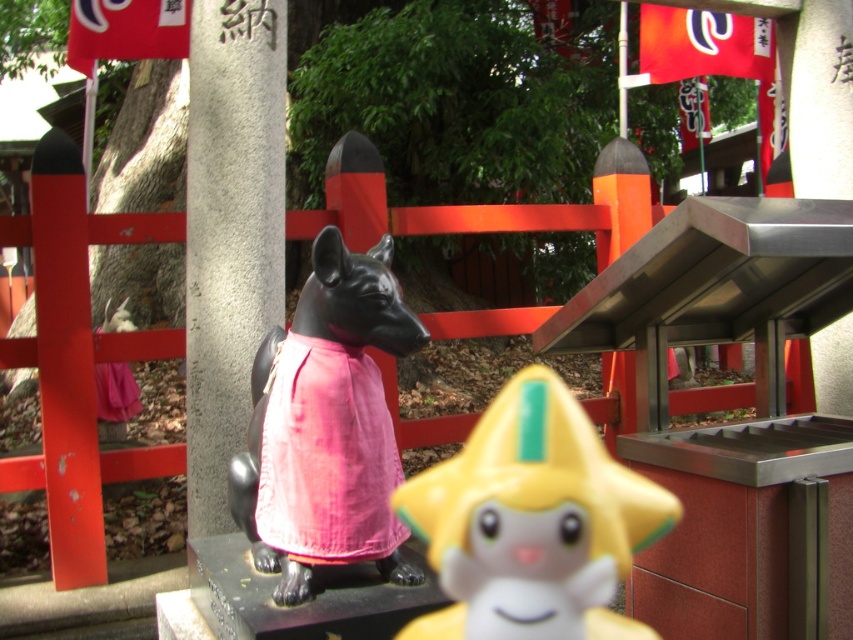
Question: Is gray stone pillar at center positioned before pink cotton dress at center?

Choices:
 (A) yes
 (B) no

Answer: (B)

Question: Which object is farther from the camera taking this photo?

Choices:
 (A) gray stone pillar at center
 (B) pink cotton dress at center
 (C) yellow plastic star at center
 (D) black matte dog at center

Answer: (A)

Question: Can you confirm if black matte dog at center is wider than gray stone pillar at center?

Choices:
 (A) no
 (B) yes

Answer: (B)

Question: Which of these objects is positioned farthest from the pink cotton dress at center?

Choices:
 (A) black matte dog at center
 (B) yellow plastic star at center

Answer: (B)

Question: Estimate the real-world distances between objects in this image. Which object is closer to the gray stone pillar at center?

Choices:
 (A) yellow plastic star at center
 (B) pink cotton dress at center
 (C) black matte dog at center

Answer: (C)

Question: Is black matte dog at center below pink cotton dress at center?

Choices:
 (A) yes
 (B) no

Answer: (B)